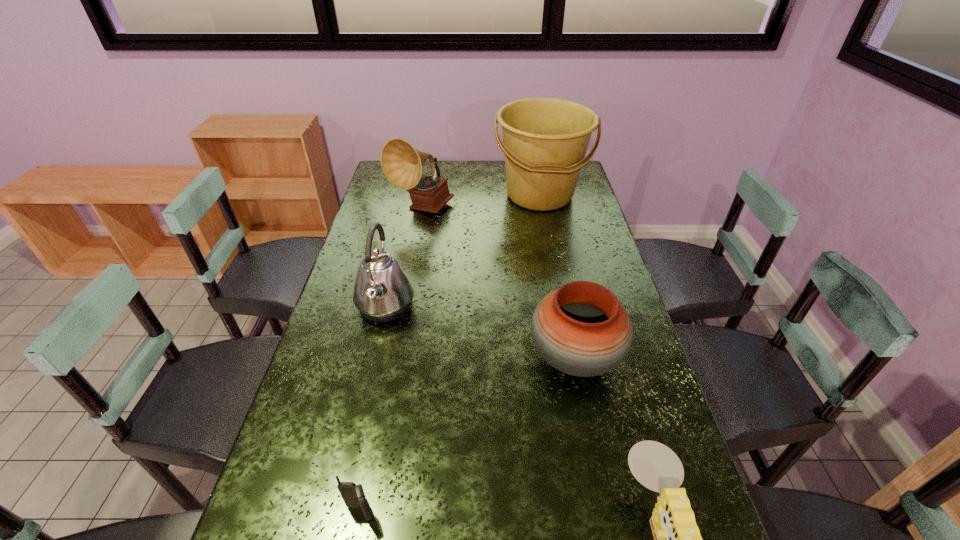
Locate an element on the screen. This screenshot has height=540, width=960. free area in between the fourth tallest object and the shortest object is located at coordinates (468, 435).

Where is `free area in between the cellular telephone and the pottery`? Image resolution: width=960 pixels, height=540 pixels. free area in between the cellular telephone and the pottery is located at coordinates (468, 435).

This screenshot has width=960, height=540. In order to click on empty location between the shortest object and the kettle in this screenshot , I will do `click(372, 410)`.

You are a GUI agent. You are given a task and a screenshot of the screen. Output one action in this format:
    pyautogui.click(x=<x>, y=<y>)
    Task: Click on the free area in between the shortest object and the kettle
    
    Given the screenshot: What is the action you would take?
    pyautogui.click(x=372, y=410)

What are the coordinates of `object that is the fifth closest one to the third shortest object` in the screenshot? It's located at coord(402,164).

Identify which object is the closest to the kettle. Please provide its 2D coordinates. Your answer should be formatted as a tuple, i.e. [(x, y)], where the tuple contains the x and y coordinates of a point satisfying the conditions above.

[(402, 164)]

This screenshot has height=540, width=960. I want to click on free point that satisfies the following two spatial constraints: 1. on the horn of the phonograph record; 2. on the left side of the pottery, so click(395, 358).